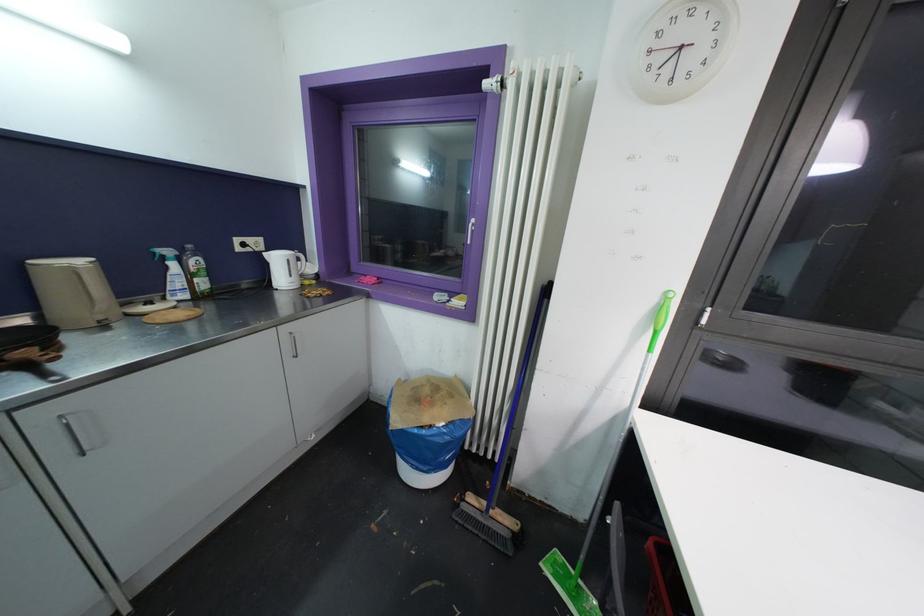
At what (x,y) coordinates should I click in order to perform the action: click on white window handle. Please return your answer as a coordinate pair (x, y). Image resolution: width=924 pixels, height=616 pixels. Looking at the image, I should click on (468, 233).